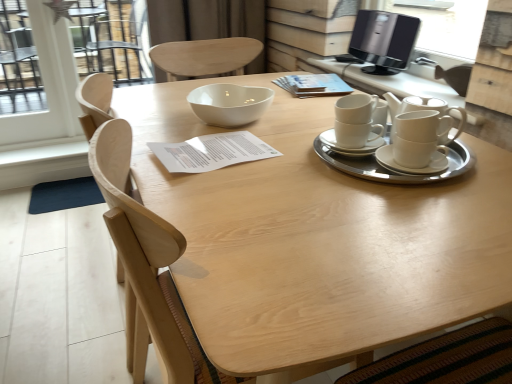
Question: Is the depth of black glossy computer monitor at upper right greater than that of light wood chair at center?

Choices:
 (A) yes
 (B) no

Answer: (A)

Question: From the image's perspective, does black glossy computer monitor at upper right appear lower than light wood chair at center?

Choices:
 (A) yes
 (B) no

Answer: (B)

Question: Is black glossy computer monitor at upper right aimed at light wood chair at center?

Choices:
 (A) yes
 (B) no

Answer: (B)

Question: Is black glossy computer monitor at upper right at the right side of light wood chair at center?

Choices:
 (A) yes
 (B) no

Answer: (A)

Question: From a real-world perspective, is black glossy computer monitor at upper right located higher than light wood chair at center?

Choices:
 (A) yes
 (B) no

Answer: (A)

Question: Is the position of black glossy computer monitor at upper right less distant than that of light wood chair at center?

Choices:
 (A) yes
 (B) no

Answer: (B)

Question: Considering the relative sizes of white ceramic saucer at right and white ceramic tea set at right in the image provided, is white ceramic saucer at right wider than white ceramic tea set at right?

Choices:
 (A) no
 (B) yes

Answer: (A)

Question: Is white ceramic saucer at right shorter than white ceramic tea set at right?

Choices:
 (A) yes
 (B) no

Answer: (A)

Question: From the image's perspective, does white ceramic saucer at right appear lower than white ceramic tea set at right?

Choices:
 (A) no
 (B) yes

Answer: (A)

Question: Is white ceramic saucer at right closer to the viewer compared to white ceramic tea set at right?

Choices:
 (A) no
 (B) yes

Answer: (A)

Question: Is white ceramic saucer at right positioned beyond the bounds of white ceramic tea set at right?

Choices:
 (A) yes
 (B) no

Answer: (B)

Question: From a real-world perspective, is white ceramic saucer at right located higher than white ceramic tea set at right?

Choices:
 (A) yes
 (B) no

Answer: (A)

Question: Is light wood chair at center oriented away from white ceramic tea set at right?

Choices:
 (A) yes
 (B) no

Answer: (B)